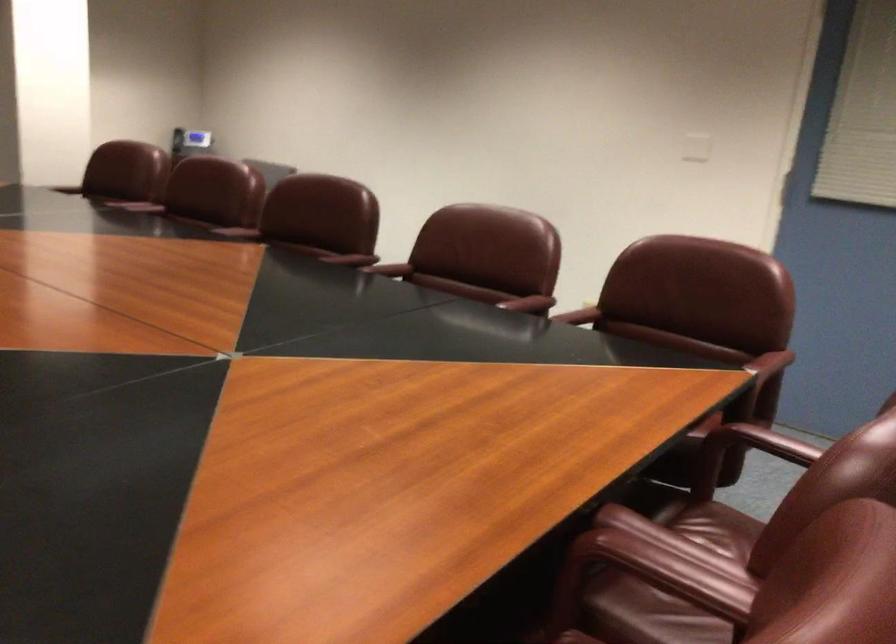
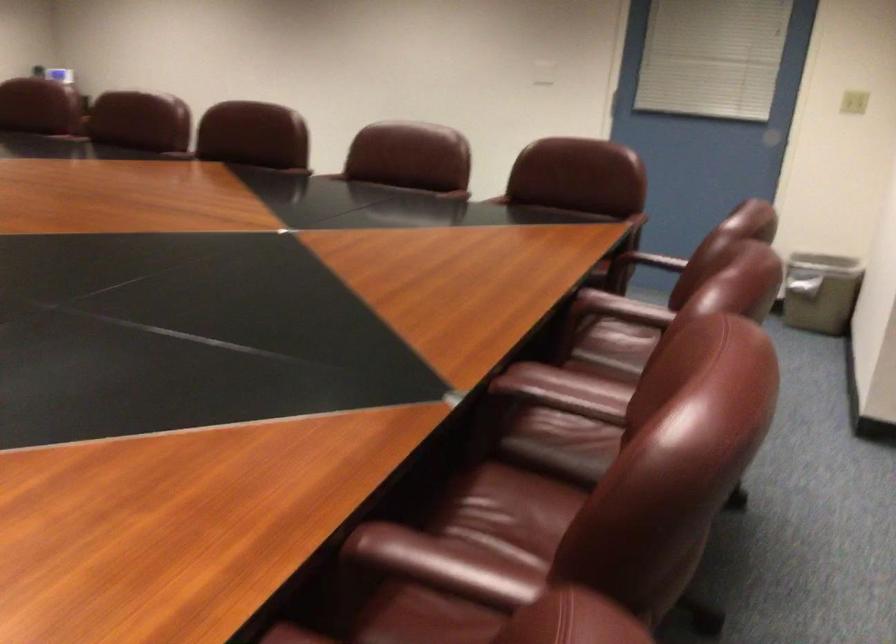
Question: The camera is either moving clockwise (left) or counter-clockwise (right) around the object. The first image is from the beginning of the video and the second image is from the end. Is the camera moving left or right when shooting the video?

Choices:
 (A) Left
 (B) Right

Answer: (A)